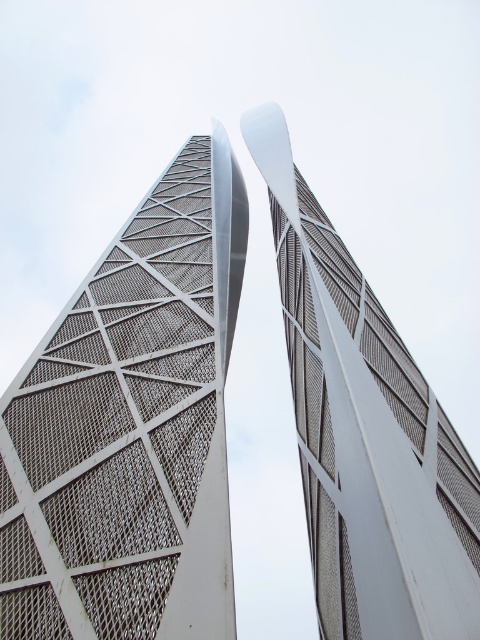
Question: Does white mesh tower at center have a smaller size compared to white mesh tower at upper center?

Choices:
 (A) no
 (B) yes

Answer: (B)

Question: Among these objects, which one is nearest to the camera?

Choices:
 (A) white mesh tower at center
 (B) white mesh tower at upper center

Answer: (B)

Question: Is white mesh tower at center bigger than white mesh tower at upper center?

Choices:
 (A) yes
 (B) no

Answer: (B)

Question: Is the position of white mesh tower at center more distant than that of white mesh tower at upper center?

Choices:
 (A) yes
 (B) no

Answer: (A)